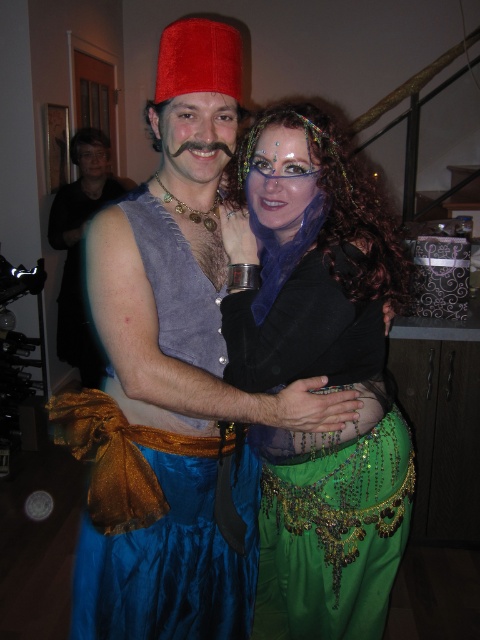
Question: Does blue satin vest at center lie in front of shiny blue vest at center?

Choices:
 (A) yes
 (B) no

Answer: (A)

Question: Is the position of matte velvet fez at upper center more distant than that of green sequined skirt at center?

Choices:
 (A) no
 (B) yes

Answer: (A)

Question: Which object appears closest to the camera in this image?

Choices:
 (A) shiny blue vest at center
 (B) matte velvet fez at upper center
 (C) blue satin vest at center

Answer: (B)

Question: Which of the following is the closest to the observer?

Choices:
 (A) (112, 205)
 (B) (142, 208)

Answer: (A)

Question: Which point is closer to the camera taking this photo?

Choices:
 (A) (326, 620)
 (B) (180, 420)

Answer: (B)

Question: Is blue satin vest at center wider than shiny blue vest at center?

Choices:
 (A) yes
 (B) no

Answer: (B)